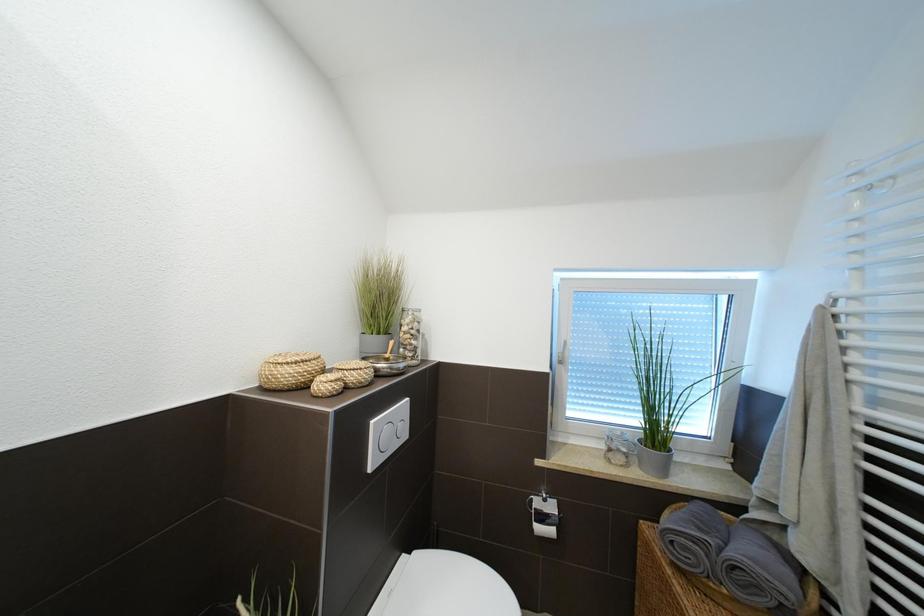
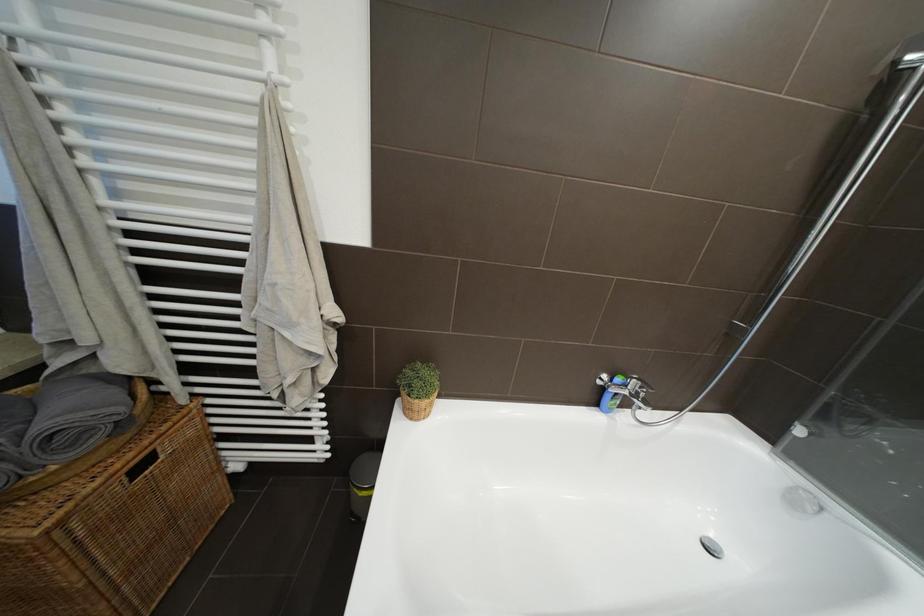
Based on the photo, how did the camera likely rotate?

The camera rotated toward right-down.